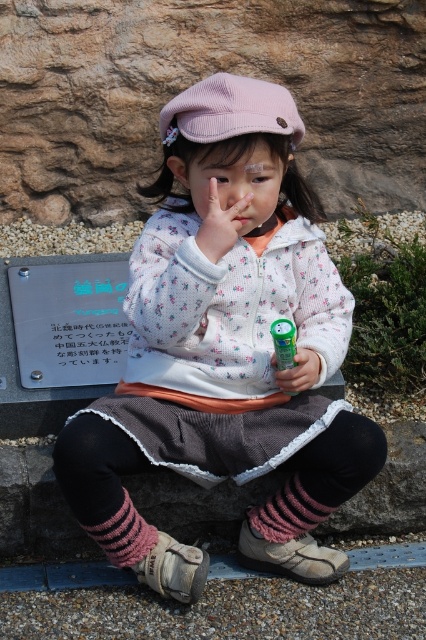
You are a photographer standing at a specific position and want to take a picture of the child wearing the pink corduroy cap at upper center. The camera you are using has a maximum focus range of 6 feet. Will you be able to capture the child clearly in your photo?

The pink corduroy cap at upper center and camera are 6.40 feet apart. Since the camera can only focus up to 6 feet, the distance is too far, so the child will not be in clear focus.

The child is holding a green matte toy at center in one hand and has a knitted pink sock at lower center near their feet. Which object is closer to the ground?

The knitted pink sock at lower center is closer to the ground because it is positioned below the green matte toy at center.